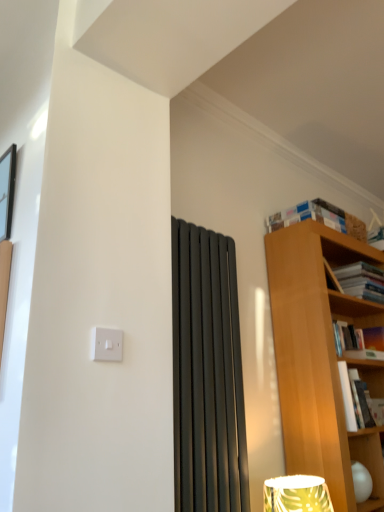
I want to click on hardcover book at upper right, which ranks as the third book in bottom-to-top order, so click(x=361, y=281).

The height and width of the screenshot is (512, 384). What are the coordinates of `hardcover book at upper right, which ranks as the third book in top-to-bottom order` in the screenshot? It's located at (359, 342).

What is the approximate width of white paperbacks at upper right, placed as the first book when sorted from top to bottom?

The width of white paperbacks at upper right, placed as the first book when sorted from top to bottom, is 28.83 centimeters.

Identify the location of hardcover book at upper right, arranged as the second book when viewed from the top. (361, 281).

Which object is positioned more to the right, hardcover book at upper right, the second book from the bottom, or black glass picture frame at upper left?

hardcover book at upper right, the second book from the bottom, is more to the right.

From the image's perspective, which one is positioned higher, hardcover book at upper right, the second book from the bottom, or black glass picture frame at upper left?

black glass picture frame at upper left.

From the image's perspective, is hardcover book at upper right, which ranks as the third book in bottom-to-top order, located beneath black glass picture frame at upper left?

Correct, hardcover book at upper right, which ranks as the third book in bottom-to-top order, appears lower than black glass picture frame at upper left in the image.

Considering the sizes of objects hardcover book at upper right, which ranks as the third book in bottom-to-top order, and black glass picture frame at upper left in the image provided, who is smaller, hardcover book at upper right, which ranks as the third book in bottom-to-top order, or black glass picture frame at upper left?

→ With smaller size is black glass picture frame at upper left.

Which is in front, hardcover book at upper right, which ranks as the third book in bottom-to-top order, or black glass picture frame at upper left?

black glass picture frame at upper left is closer to the camera.

Is white plastic light switch at upper left outside of black glass picture frame at upper left?

Yes, white plastic light switch at upper left is outside of black glass picture frame at upper left.

From the image's perspective, which object appears higher, white plastic light switch at upper left or black glass picture frame at upper left?

black glass picture frame at upper left appears higher in the image.

Would you say white plastic light switch at upper left is to the left or to the right of black glass picture frame at upper left in the picture?

Clearly, white plastic light switch at upper left is on the right of black glass picture frame at upper left in the image.

Could you measure the distance between white plastic light switch at upper left and black glass picture frame at upper left?

white plastic light switch at upper left and black glass picture frame at upper left are 21.04 inches apart from each other.

Based on the photo, from a real-world perspective, which object stands above the other?

In real-world perspective, white paperbacks at upper right, placed as the first book when sorted from top to bottom, is above.

Can you confirm if black glass picture frame at upper left is taller than white paperbacks at upper right, arranged as the fourth book when ordered from the bottom?

Yes, black glass picture frame at upper left is taller than white paperbacks at upper right, arranged as the fourth book when ordered from the bottom.

Which is closer, (5, 182) or (285, 223)?

The point (5, 182) is more forward.

Does black glass picture frame at upper left turn towards white paperbacks at upper right, arranged as the fourth book when ordered from the bottom?

No, black glass picture frame at upper left does not turn towards white paperbacks at upper right, arranged as the fourth book when ordered from the bottom.

Looking at this image, is hardcover book at upper right, which ranks as the third book in top-to-bottom order, positioned in front of white paperbacks at upper right, placed as the first book when sorted from top to bottom?

No.

Is hardcover book at upper right, which ranks as the third book in top-to-bottom order, far from white paperbacks at upper right, arranged as the fourth book when ordered from the bottom?

That's not correct — hardcover book at upper right, which ranks as the third book in top-to-bottom order, is a little close to white paperbacks at upper right, arranged as the fourth book when ordered from the bottom.

Can you confirm if hardcover book at upper right, which ranks as the third book in top-to-bottom order, is thinner than white paperbacks at upper right, arranged as the fourth book when ordered from the bottom?

Correct, the width of hardcover book at upper right, which ranks as the third book in top-to-bottom order, is less than that of white paperbacks at upper right, arranged as the fourth book when ordered from the bottom.

How different are the orientations of hardcover book at right, which ranks as the first book in bottom-to-top order, and white plastic light switch at upper left in degrees?

The facing directions of hardcover book at right, which ranks as the first book in bottom-to-top order, and white plastic light switch at upper left are 0.0105 degrees apart.

From the image's perspective, between hardcover book at right, which ranks as the first book in bottom-to-top order, and white plastic light switch at upper left, which one is located above?

white plastic light switch at upper left, from the image's perspective.

Looking at this image, considering their positions, is hardcover book at right, the 4th book viewed from the top, located in front of or behind white plastic light switch at upper left?

Clearly, hardcover book at right, the 4th book viewed from the top, is behind white plastic light switch at upper left.

In terms of width, does hardcover book at upper right, the second book from the bottom, look wider or thinner when compared to hardcover book at upper right, which ranks as the third book in bottom-to-top order?

hardcover book at upper right, the second book from the bottom, is thinner than hardcover book at upper right, which ranks as the third book in bottom-to-top order.

Is point (339, 341) positioned behind point (350, 266)?

No.

Considering the relative positions of hardcover book at upper right, the second book from the bottom, and hardcover book at upper right, which ranks as the third book in bottom-to-top order, in the image provided, is hardcover book at upper right, the second book from the bottom, in front of hardcover book at upper right, which ranks as the third book in bottom-to-top order,?

That is False.

How distant is hardcover book at upper right, which ranks as the third book in top-to-bottom order, from hardcover book at upper right, which ranks as the third book in bottom-to-top order?

hardcover book at upper right, which ranks as the third book in top-to-bottom order, is 25.39 centimeters away from hardcover book at upper right, which ranks as the third book in bottom-to-top order.

I want to click on the 2nd book positioned below the black glass picture frame at upper left (from the image's perspective), so click(359, 342).

Find the location of `picture frame that appears above the hardcover book at upper right, arranged as the second book when viewed from the top (from the image's perspective)`. picture frame that appears above the hardcover book at upper right, arranged as the second book when viewed from the top (from the image's perspective) is located at coordinates (7, 191).

Based on their spatial positions, is hardcover book at right, the 4th book viewed from the top, or hardcover book at upper right, the second book from the bottom, closer to hardcover book at upper right, which ranks as the third book in bottom-to-top order?

The object closer to hardcover book at upper right, which ranks as the third book in bottom-to-top order, is hardcover book at upper right, the second book from the bottom.

Looking at the image, which one is located further to hardcover book at upper right, arranged as the second book when viewed from the top, hardcover book at upper right, which ranks as the third book in top-to-bottom order, or black glass picture frame at upper left?

The object further to hardcover book at upper right, arranged as the second book when viewed from the top, is black glass picture frame at upper left.

From the image, which object appears to be farther from hardcover book at right, which ranks as the first book in bottom-to-top order, white paperbacks at upper right, placed as the first book when sorted from top to bottom, or black glass picture frame at upper left?

Based on the image, black glass picture frame at upper left appears to be further to hardcover book at right, which ranks as the first book in bottom-to-top order.

Considering their positions, is hardcover book at right, the 4th book viewed from the top, positioned further to hardcover book at upper right, arranged as the second book when viewed from the top, than black glass picture frame at upper left?

Among the two, black glass picture frame at upper left is located further to hardcover book at upper right, arranged as the second book when viewed from the top.

Considering their positions, is white paperbacks at upper right, arranged as the fourth book when ordered from the bottom, positioned closer to hardcover book at upper right, arranged as the second book when viewed from the top, than hardcover book at upper right, the second book from the bottom?

Among the two, hardcover book at upper right, the second book from the bottom, is located nearer to hardcover book at upper right, arranged as the second book when viewed from the top.

Looking at the image, which one is located further to hardcover book at upper right, which ranks as the third book in top-to-bottom order, hardcover book at upper right, which ranks as the third book in bottom-to-top order, or white paperbacks at upper right, arranged as the fourth book when ordered from the bottom?

Based on the image, white paperbacks at upper right, arranged as the fourth book when ordered from the bottom, appears to be further to hardcover book at upper right, which ranks as the third book in top-to-bottom order.

Considering their positions, is white paperbacks at upper right, placed as the first book when sorted from top to bottom, positioned further to black glass picture frame at upper left than hardcover book at upper right, which ranks as the third book in top-to-bottom order?

Among the two, hardcover book at upper right, which ranks as the third book in top-to-bottom order, is located further to black glass picture frame at upper left.

Based on their spatial positions, is hardcover book at upper right, which ranks as the third book in bottom-to-top order, or white plastic light switch at upper left closer to black glass picture frame at upper left?

white plastic light switch at upper left lies closer to black glass picture frame at upper left than the other object.

Find the location of `light switch located between black glass picture frame at upper left and hardcover book at right, which ranks as the first book in bottom-to-top order, in the left-right direction`. light switch located between black glass picture frame at upper left and hardcover book at right, which ranks as the first book in bottom-to-top order, in the left-right direction is located at coordinates (106, 344).

Identify the location of book positioned between white plastic light switch at upper left and white paperbacks at upper right, placed as the first book when sorted from top to bottom, from near to far. (354, 399).

At what (x,y) coordinates should I click in order to perform the action: click on light switch between black glass picture frame at upper left and white paperbacks at upper right, arranged as the fourth book when ordered from the bottom. Please return your answer as a coordinate pair (x, y). The height and width of the screenshot is (512, 384). Looking at the image, I should click on [x=106, y=344].

Identify the location of book between white paperbacks at upper right, placed as the first book when sorted from top to bottom, and hardcover book at upper right, the second book from the bottom, in the up-down direction. The image size is (384, 512). (361, 281).